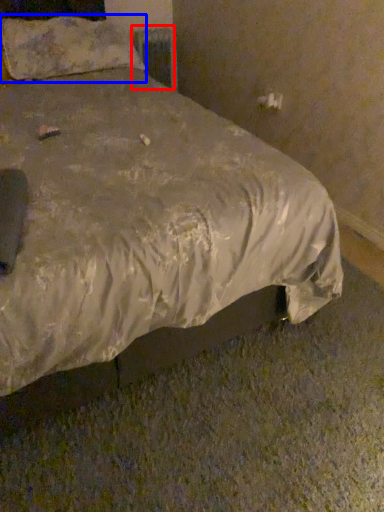
Question: Which object is closer to the camera taking this photo, radiator (highlighted by a red box) or pillow (highlighted by a blue box)?

Choices:
 (A) radiator
 (B) pillow

Answer: (B)